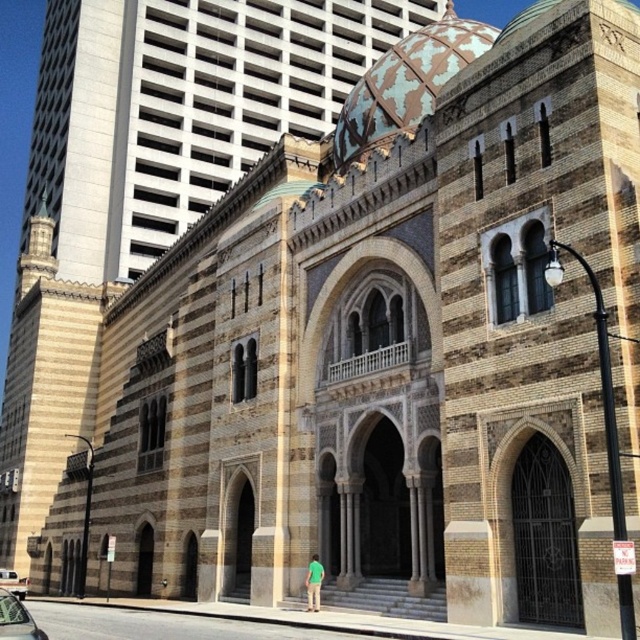
You are standing in front of the grand building and notice two points marked on the facade. The first point is at coordinates point (10, 602) and the second is at point (13, 586). Which of these points is physically closer to your current position?

Point (10, 602) is closer to the viewer than point (13, 586), so the first point is physically closer to your current position.

You are standing at the entrance of the grand building and see a metallic silver car at lower left and a silver metallic car at lower left. Which car is closer to you?

Both the metallic silver car at lower left and the silver metallic car at lower left are at the same distance since they are the same car.